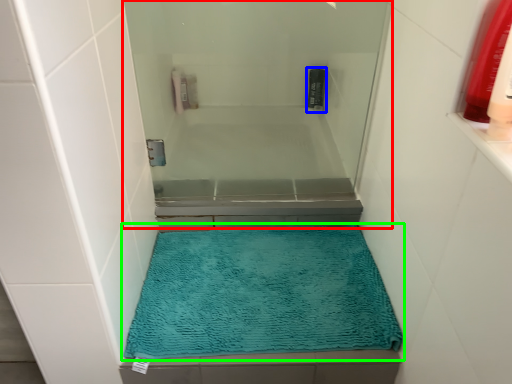
Question: Estimate the real-world distances between objects in this image. Which object is farther from screen door (highlighted by a red box), mouthwash (highlighted by a blue box) or bath mat (highlighted by a green box)?

Choices:
 (A) mouthwash
 (B) bath mat

Answer: (A)